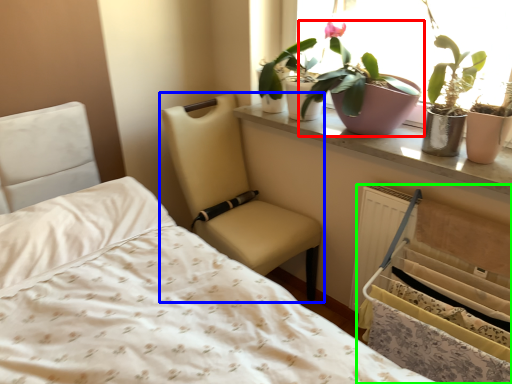
Question: Which object is the closest to the houseplant (highlighted by a red box)? Choose among these: chair (highlighted by a blue box) or bed frame (highlighted by a green box).

Choices:
 (A) chair
 (B) bed frame

Answer: (B)